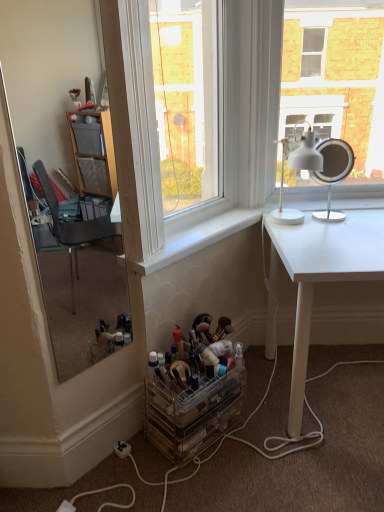
I want to click on empty space that is in between white matte table lamp at upper right, the second table lamp positioned from the right, and white plastic table lamp at upper right, which is counted as the first table lamp, starting from the right, so click(x=327, y=224).